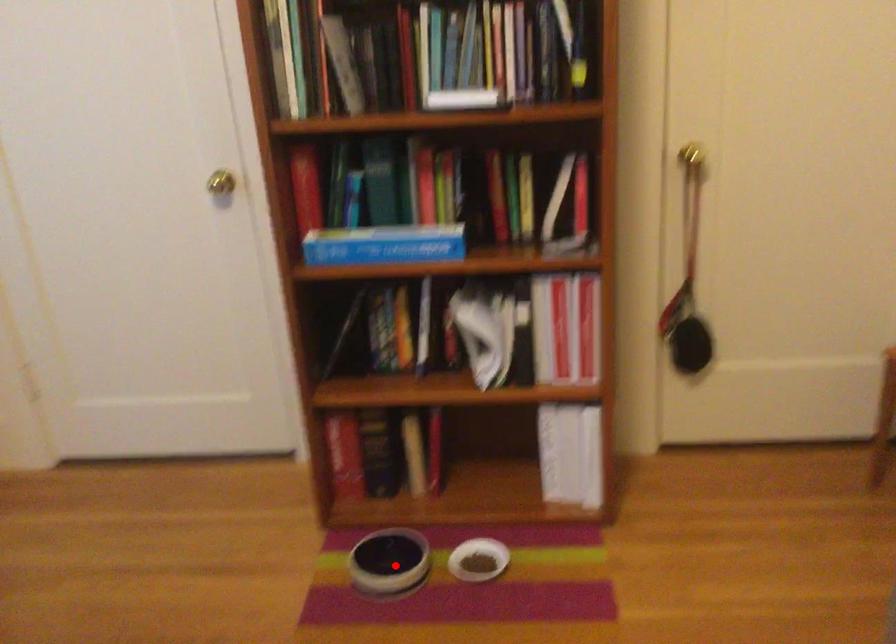
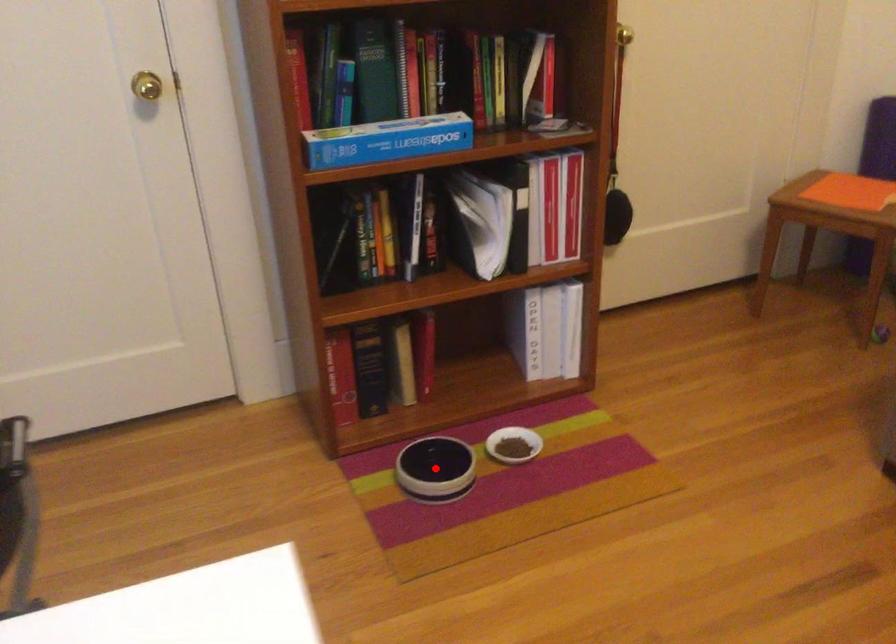
I am providing you with two images of the same scene from different viewpoints. A red point is marked on the first image and another point is marked on the second image. Do the highlighted points in image1 and image2 indicate the same real-world spot?

Yes